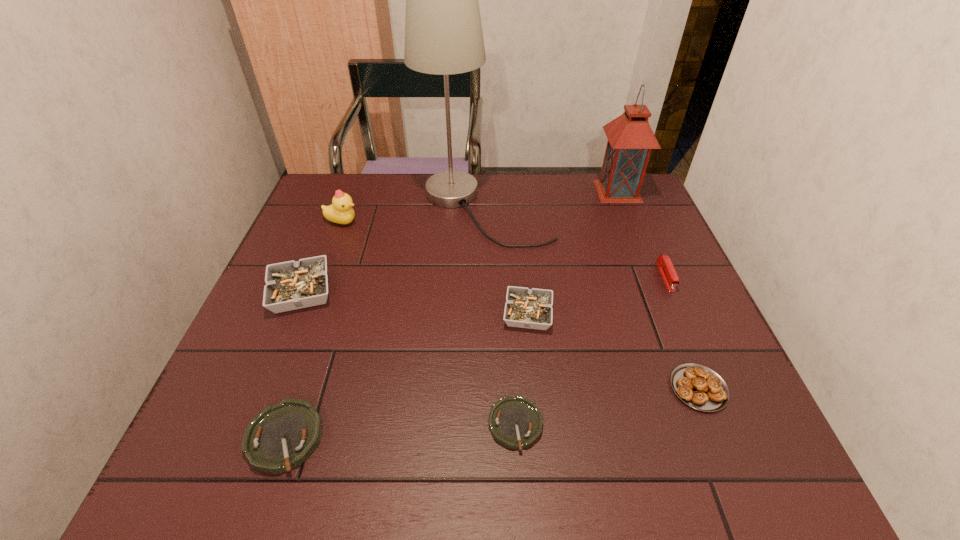
Where is `the tallest object`? the tallest object is located at coordinates (443, 32).

Identify the location of white table lamp. (443, 32).

The image size is (960, 540). I want to click on pink lantern, so click(x=630, y=141).

This screenshot has width=960, height=540. I want to click on the second tallest object, so pyautogui.click(x=630, y=141).

Identify the location of the third tallest object. (340, 211).

Where is `yellow duckling`? The width and height of the screenshot is (960, 540). yellow duckling is located at coordinates coord(340,211).

Where is `the left gray ashtray`? This screenshot has width=960, height=540. the left gray ashtray is located at coordinates tap(291, 285).

This screenshot has width=960, height=540. I want to click on the bigger gray ashtray, so click(x=291, y=285).

Identify the location of stapler. The image size is (960, 540). (665, 266).

This screenshot has height=540, width=960. Find the location of `the second tallest ashtray`. the second tallest ashtray is located at coordinates (528, 308).